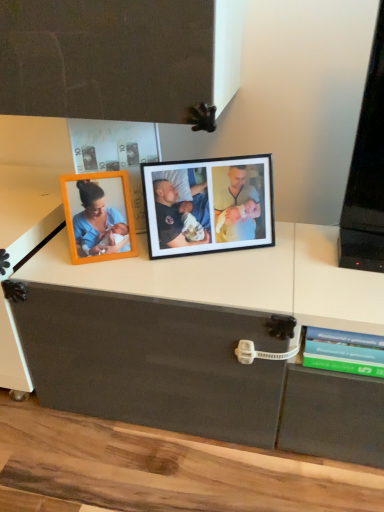
Describe the element at coordinates (208, 205) in the screenshot. This screenshot has height=512, width=384. I see `black matte photo frame at center` at that location.

At what (x,y) coordinates should I click in order to perform the action: click on black matte photo frame at center. Please return your answer as a coordinate pair (x, y). Image resolution: width=384 pixels, height=512 pixels. Looking at the image, I should click on (208, 205).

The width and height of the screenshot is (384, 512). Find the location of `green matte book at lower right`. green matte book at lower right is located at coordinates (344, 352).

In order to face green matte book at lower right, should I rotate leftwards or rightwards?

Rotate your view right by about 22.383°.

The width and height of the screenshot is (384, 512). Describe the element at coordinates (344, 352) in the screenshot. I see `green matte book at lower right` at that location.

Where is `black matte photo frame at center`? black matte photo frame at center is located at coordinates pos(208,205).

Considering the relative positions of black matte photo frame at center and green matte book at lower right in the image provided, is black matte photo frame at center to the right of green matte book at lower right from the viewer's perspective?

Incorrect, black matte photo frame at center is not on the right side of green matte book at lower right.

Is black matte photo frame at center further to camera compared to green matte book at lower right?

Yes.

Is point (211, 221) positioned in front of point (337, 362)?

That is False.

From the image's perspective, which is above, black matte photo frame at center or green matte book at lower right?

black matte photo frame at center, from the image's perspective.

From a real-world perspective, is black matte photo frame at center physically above green matte book at lower right?

Correct, in the physical world, black matte photo frame at center is higher than green matte book at lower right.

Considering the relative sizes of black matte photo frame at center and green matte book at lower right in the image provided, is black matte photo frame at center thinner than green matte book at lower right?

Yes.

In terms of height, does black matte photo frame at center look taller or shorter compared to green matte book at lower right?

Considering their sizes, black matte photo frame at center has more height than green matte book at lower right.

Is black matte photo frame at center smaller than green matte book at lower right?

Actually, black matte photo frame at center might be larger than green matte book at lower right.

Is black matte photo frame at center positioned beyond the bounds of green matte book at lower right?

Indeed, black matte photo frame at center is completely outside green matte book at lower right.

Is black matte photo frame at center with green matte book at lower right?

No, black matte photo frame at center is not touching green matte book at lower right.

Could you tell me if black matte photo frame at center is turned towards green matte book at lower right?

Yes, black matte photo frame at center is facing green matte book at lower right.

Measure the distance between black matte photo frame at center and green matte book at lower right.

black matte photo frame at center is 14.17 inches from green matte book at lower right.

This screenshot has width=384, height=512. I want to click on picture frame behind the green matte book at lower right, so click(x=208, y=205).

Considering the positions of objects green matte book at lower right and black matte photo frame at center in the image provided, who is more to the right, green matte book at lower right or black matte photo frame at center?

Positioned to the right is green matte book at lower right.

Between green matte book at lower right and black matte photo frame at center, which one is positioned behind?

black matte photo frame at center is more distant.

Does point (324, 340) come behind point (207, 231)?

That is False.

From the image's perspective, is green matte book at lower right below black matte photo frame at center?

Yes, from the image's perspective, green matte book at lower right is below black matte photo frame at center.

From a real-world perspective, is green matte book at lower right physically below black matte photo frame at center?

Yes, from a real-world perspective, green matte book at lower right is beneath black matte photo frame at center.

Which of these two, green matte book at lower right or black matte photo frame at center, is thinner?

black matte photo frame at center.

Consider the image. Between green matte book at lower right and black matte photo frame at center, which one has less height?

green matte book at lower right.

Considering the relative sizes of green matte book at lower right and black matte photo frame at center in the image provided, is green matte book at lower right bigger than black matte photo frame at center?

Incorrect, green matte book at lower right is not larger than black matte photo frame at center.

Is green matte book at lower right spatially inside black matte photo frame at center, or outside of it?

green matte book at lower right is spatially situated outside black matte photo frame at center.

Is green matte book at lower right touching black matte photo frame at center?

green matte book at lower right and black matte photo frame at center are not in contact.

Is green matte book at lower right positioned with its back to black matte photo frame at center?

That's not correct — green matte book at lower right is not looking away from black matte photo frame at center.

How many degrees apart are the facing directions of green matte book at lower right and black matte photo frame at center?

24.3 degrees.

Where is `book to the right of black matte photo frame at center`? Image resolution: width=384 pixels, height=512 pixels. book to the right of black matte photo frame at center is located at coordinates (344, 352).

Image resolution: width=384 pixels, height=512 pixels. I want to click on book beneath the black matte photo frame at center (from a real-world perspective), so click(344, 352).

Where is `book below the black matte photo frame at center (from the image's perspective)`? The width and height of the screenshot is (384, 512). book below the black matte photo frame at center (from the image's perspective) is located at coordinates (344, 352).